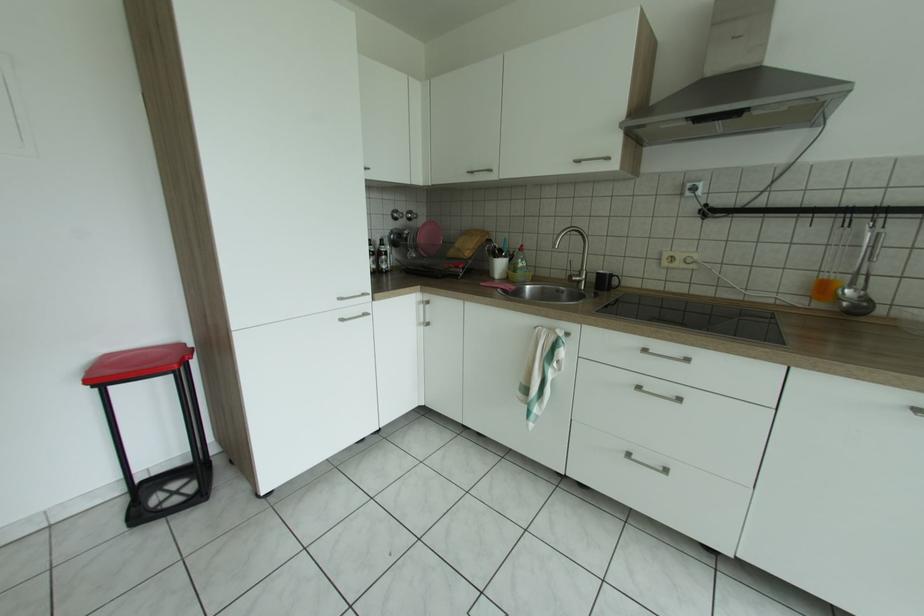
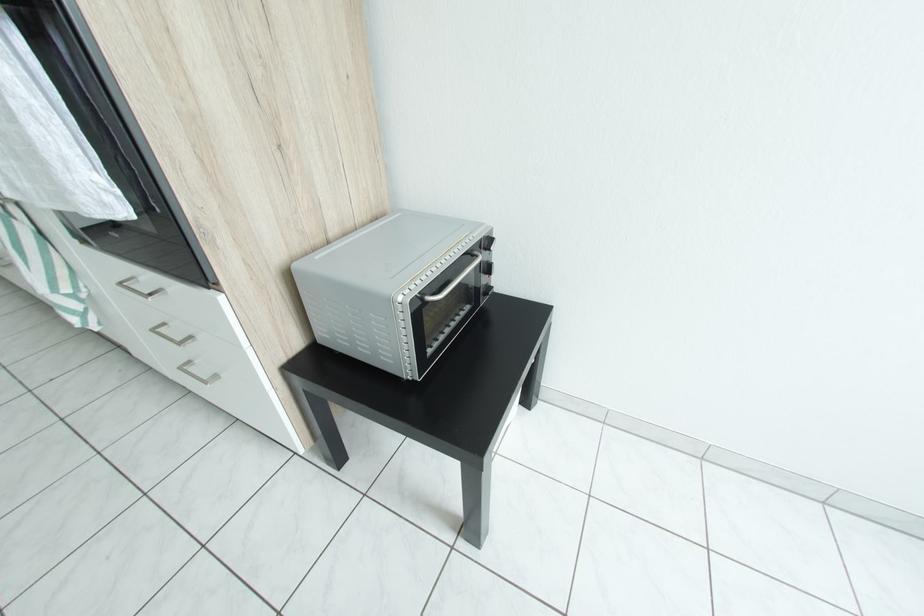
Question: What movement of the cameraman would produce the second image?

Choices:
 (A) Left
 (B) Right
 (C) Forward
 (D) Backward

Answer: (B)